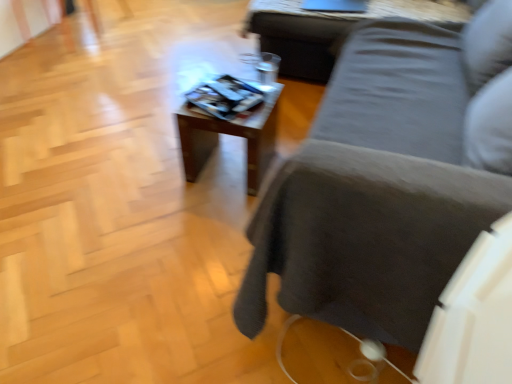
Question: From the image's perspective, does wooden table at center, which ranks as the 1th table in left-to-right order, appear lower than wooden table at upper center, the 2th table in the left-to-right sequence?

Choices:
 (A) no
 (B) yes

Answer: (B)

Question: Is wooden table at center, which ranks as the 1th table in left-to-right order, facing towards wooden table at upper center, the second table from the bottom?

Choices:
 (A) no
 (B) yes

Answer: (A)

Question: Can you confirm if wooden table at center, arranged as the first table when viewed from the front, is shorter than wooden table at upper center, placed as the first table when sorted from top to bottom?

Choices:
 (A) yes
 (B) no

Answer: (B)

Question: Is wooden table at upper center, marked as the 2th table in a front-to-back arrangement, a part of wooden table at center, acting as the 2th table starting from the right?

Choices:
 (A) yes
 (B) no

Answer: (B)

Question: Is wooden table at center, placed as the first table when sorted from bottom to top, looking in the opposite direction of wooden table at upper center, the 2th table in the left-to-right sequence?

Choices:
 (A) no
 (B) yes

Answer: (A)

Question: In terms of width, does dark gray fabric couch at center look wider or thinner when compared to wooden table at upper center, which is the 1th table from back to front?

Choices:
 (A) thin
 (B) wide

Answer: (B)

Question: From a real-world perspective, is dark gray fabric couch at center positioned above or below wooden table at upper center, placed as the first table when sorted from top to bottom?

Choices:
 (A) above
 (B) below

Answer: (A)

Question: From the image's perspective, is dark gray fabric couch at center located above or below wooden table at upper center, which is the first table in right-to-left order?

Choices:
 (A) below
 (B) above

Answer: (A)

Question: In terms of height, does dark gray fabric couch at center look taller or shorter compared to wooden table at upper center, marked as the 2th table in a front-to-back arrangement?

Choices:
 (A) tall
 (B) short

Answer: (A)

Question: Looking at the image, does wooden table at center, acting as the 2th table starting from the right, seem bigger or smaller compared to wooden table at upper center, placed as the first table when sorted from top to bottom?

Choices:
 (A) big
 (B) small

Answer: (B)

Question: Is wooden table at center, acting as the 2th table starting from the right, spatially inside wooden table at upper center, which is the 1th table from back to front, or outside of it?

Choices:
 (A) outside
 (B) inside

Answer: (A)

Question: From a real-world perspective, is wooden table at center, which is the 2th table in back-to-front order, physically located above or below wooden table at upper center, marked as the 2th table in a front-to-back arrangement?

Choices:
 (A) above
 (B) below

Answer: (B)

Question: Looking at their shapes, would you say wooden table at center, placed as the first table when sorted from bottom to top, is wider or thinner than wooden table at upper center, placed as the first table when sorted from top to bottom?

Choices:
 (A) wide
 (B) thin

Answer: (B)

Question: From the image's perspective, is wooden table at upper center, which is the 1th table from back to front, positioned above or below wooden table at center, placed as the first table when sorted from bottom to top?

Choices:
 (A) below
 (B) above

Answer: (B)

Question: Is wooden table at upper center, the second table from the bottom, wider or thinner than wooden table at center, which is the 2th table in top-to-bottom order?

Choices:
 (A) wide
 (B) thin

Answer: (A)